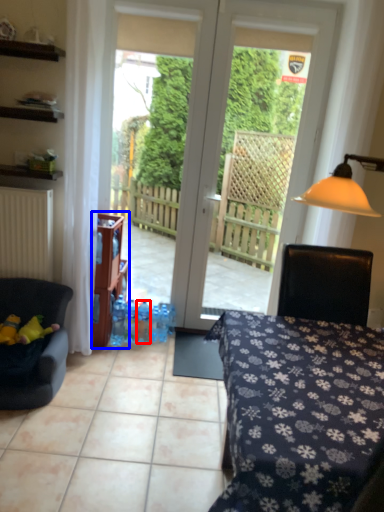
Question: Which object is further to the camera taking this photo, bottle (highlighted by a red box) or shelf (highlighted by a blue box)?

Choices:
 (A) bottle
 (B) shelf

Answer: (A)